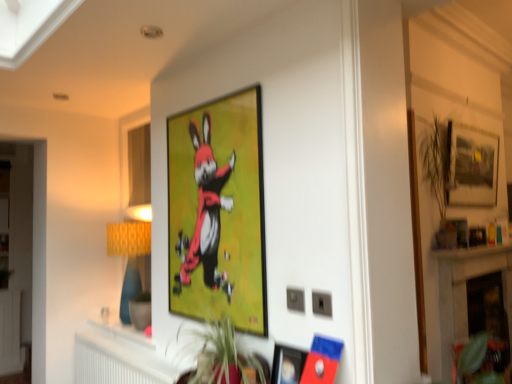
Question: Is white marble fireplace at lower right wider than white plastic radiator at lower center?

Choices:
 (A) no
 (B) yes

Answer: (A)

Question: Is there a large distance between white marble fireplace at lower right and white plastic radiator at lower center?

Choices:
 (A) no
 (B) yes

Answer: (B)

Question: Is white plastic radiator at lower center a part of white marble fireplace at lower right?

Choices:
 (A) no
 (B) yes

Answer: (A)

Question: Considering the relative sizes of white marble fireplace at lower right and white plastic radiator at lower center in the image provided, is white marble fireplace at lower right bigger than white plastic radiator at lower center?

Choices:
 (A) no
 (B) yes

Answer: (B)

Question: From a real-world perspective, is white marble fireplace at lower right on white plastic radiator at lower center?

Choices:
 (A) yes
 (B) no

Answer: (A)

Question: In terms of height, does green leafy plant at lower right, placed as the 2th plant when sorted from front to back, look taller or shorter compared to yellow fabric lampshade at left?

Choices:
 (A) short
 (B) tall

Answer: (A)

Question: Relative to yellow fabric lampshade at left, is green leafy plant at lower right, marked as the first plant in a bottom-to-top arrangement, in front or behind?

Choices:
 (A) behind
 (B) front

Answer: (A)

Question: Would you say green leafy plant at lower right, marked as the first plant in a bottom-to-top arrangement, is to the left or to the right of yellow fabric lampshade at left in the picture?

Choices:
 (A) left
 (B) right

Answer: (B)

Question: Does point (479, 342) appear closer or farther from the camera than point (142, 266)?

Choices:
 (A) closer
 (B) farther

Answer: (A)

Question: From a real-world perspective, is green leafy plant at lower right, marked as the 2th plant in a left-to-right arrangement, positioned above or below matte plastic picture frame at lower center, the second picture frame from the right?

Choices:
 (A) below
 (B) above

Answer: (A)

Question: In terms of width, does green leafy plant at lower right, placed as the 2th plant when sorted from front to back, look wider or thinner when compared to matte plastic picture frame at lower center, marked as the third picture frame in a back-to-front arrangement?

Choices:
 (A) wide
 (B) thin

Answer: (A)

Question: From the image's perspective, is green leafy plant at lower right, arranged as the 1th plant when viewed from the right, above or below matte plastic picture frame at lower center, marked as the third picture frame in a back-to-front arrangement?

Choices:
 (A) above
 (B) below

Answer: (B)

Question: Looking at the image, does green leafy plant at lower right, the 1th plant when ordered from back to front, seem bigger or smaller compared to matte plastic picture frame at lower center, marked as the third picture frame in a back-to-front arrangement?

Choices:
 (A) big
 (B) small

Answer: (A)

Question: Is matte plastic picture frame at lower center, which is counted as the second picture frame, starting from the left, taller or shorter than matte black picture frame at upper right, the third picture frame viewed from the front?

Choices:
 (A) short
 (B) tall

Answer: (A)

Question: In the image, is matte plastic picture frame at lower center, the 1th picture frame when ordered from front to back, positioned in front of or behind matte black picture frame at upper right, the 1th picture frame viewed from the right?

Choices:
 (A) behind
 (B) front

Answer: (B)